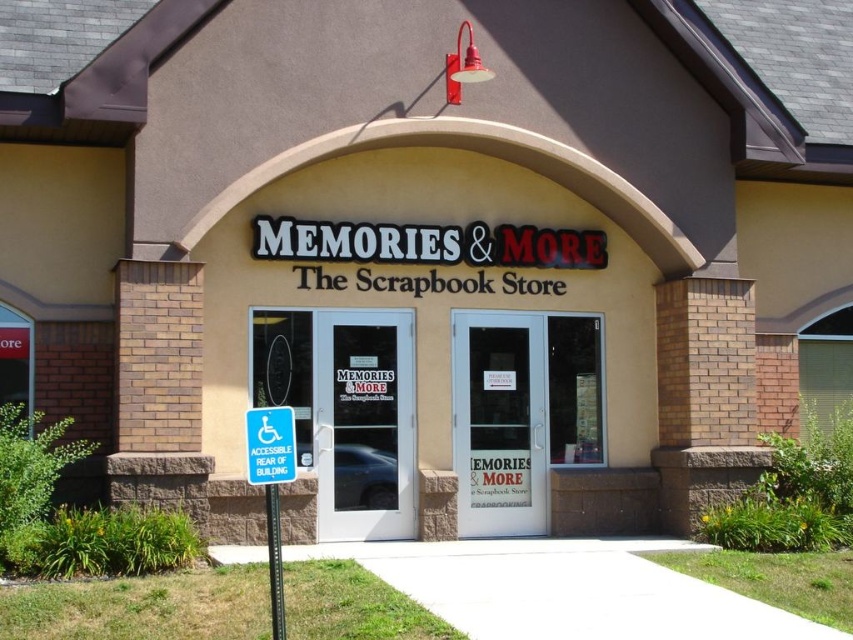
Question: Which point is farther to the camera?

Choices:
 (A) transparent glass door at center
 (B) clear glass door at center
 (C) blue plastic sign at center
 (D) blue plastic sign at lower left

Answer: (B)

Question: Which point is farther to the camera?

Choices:
 (A) clear glass door at center
 (B) blue plastic sign at center
 (C) blue plastic sign at lower left

Answer: (A)

Question: Is transparent glass door at center to the right of blue plastic sign at center from the viewer's perspective?

Choices:
 (A) no
 (B) yes

Answer: (B)

Question: Which of these objects is positioned closest to the clear glass door at center?

Choices:
 (A) blue plastic sign at center
 (B) blue plastic sign at lower left
 (C) transparent glass door at center

Answer: (C)

Question: Is the position of blue plastic sign at lower left more distant than that of blue plastic sign at center?

Choices:
 (A) yes
 (B) no

Answer: (A)

Question: Does clear glass door at center come behind blue plastic sign at lower left?

Choices:
 (A) yes
 (B) no

Answer: (A)